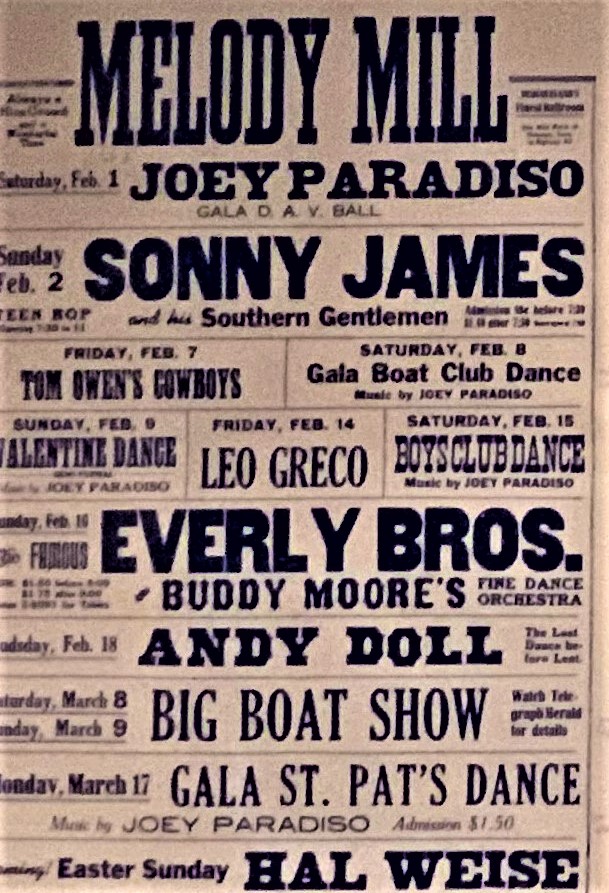
Locate an element on the screen. The width and height of the screenshot is (609, 893). vintage showrunner poster is located at coordinates (264, 355), (309, 872).